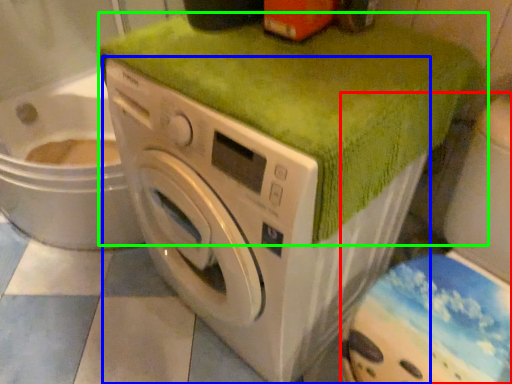
Question: Based on their relative distances, which object is farther from washer (highlighted by a red box)? Choose from washing machine (highlighted by a blue box) and bath towel (highlighted by a green box).

Choices:
 (A) washing machine
 (B) bath towel

Answer: (B)